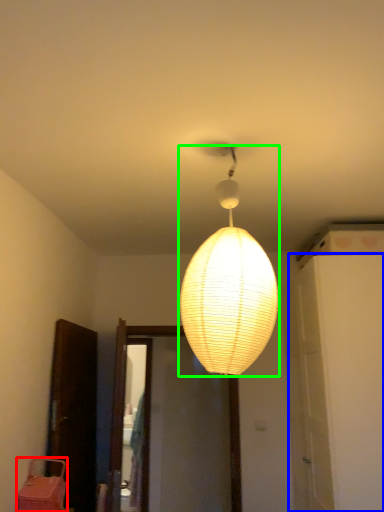
Question: Which object is the closest to the furniture (highlighted by a red box)? Choose among these: door (highlighted by a blue box) or lamp (highlighted by a green box).

Choices:
 (A) door
 (B) lamp

Answer: (B)